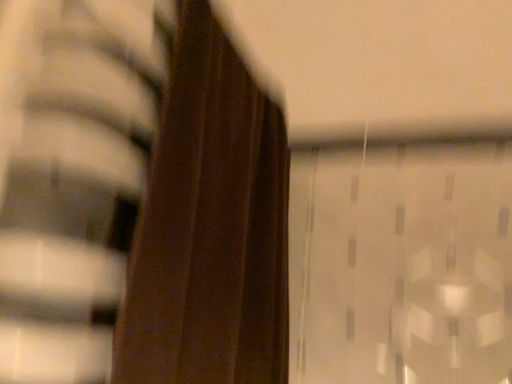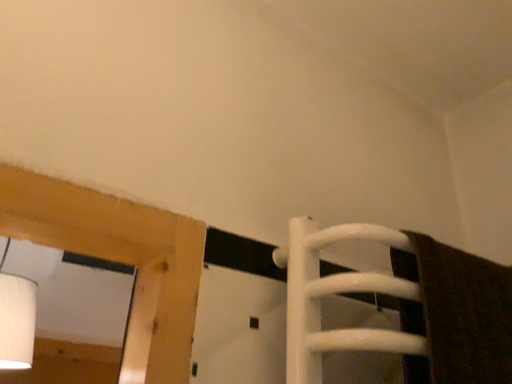
Question: How did the camera likely rotate when shooting the video?

Choices:
 (A) rotated upward
 (B) rotated downward

Answer: (A)